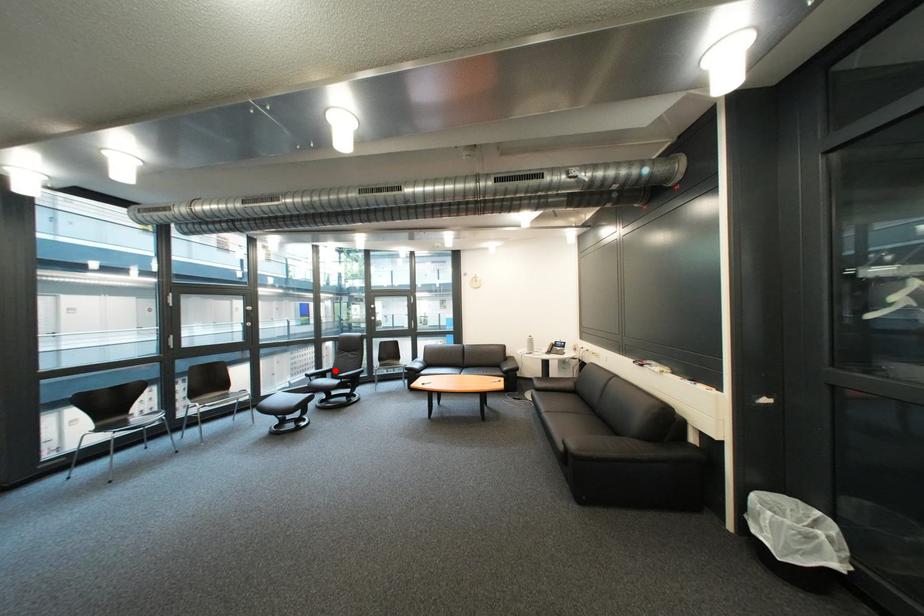
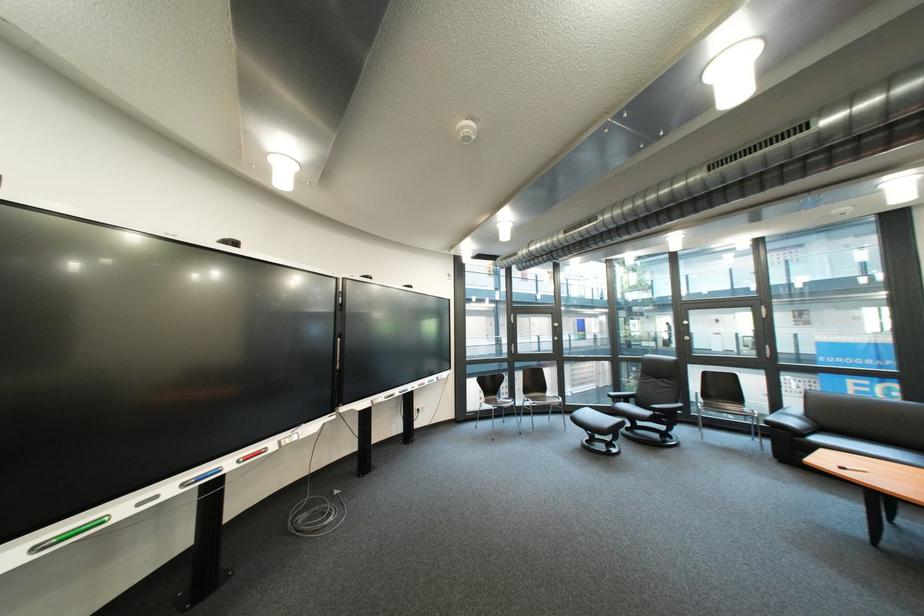
In the second image, find the point that corresponds to the highlighted location in the first image.

(634, 392)